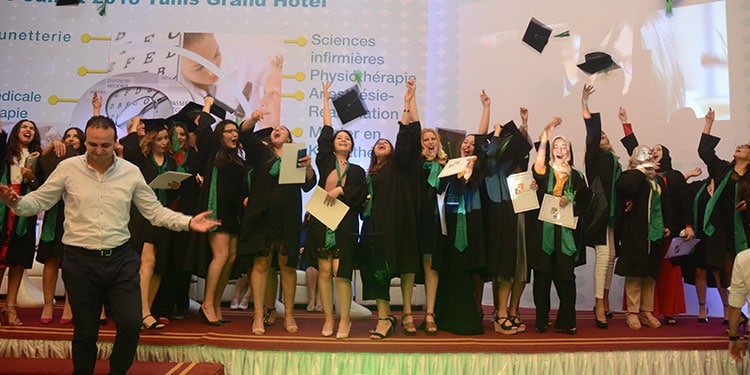
This screenshot has width=750, height=375. What are the coordinates of `stage skirt` in the screenshot? It's located at (364, 364).